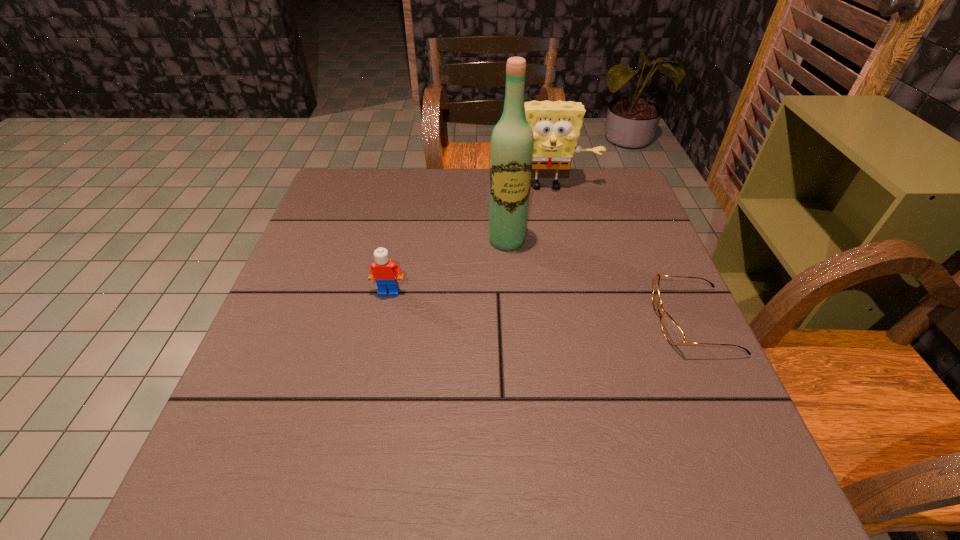
You are a GUI agent. You are given a task and a screenshot of the screen. Output one action in this format:
    pyautogui.click(x=<x>, y=<y>)
    Task: Click on the free space on the desktop that is between the third tallest object and the shortest object and is positioned on the face of the sponge
    The image size is (960, 540).
    Given the screenshot: What is the action you would take?
    pyautogui.click(x=564, y=308)

The height and width of the screenshot is (540, 960). I want to click on free space on the desktop that is between the Lego and the rightmost object and is positioned on the front-facing side of the tallest object, so click(518, 304).